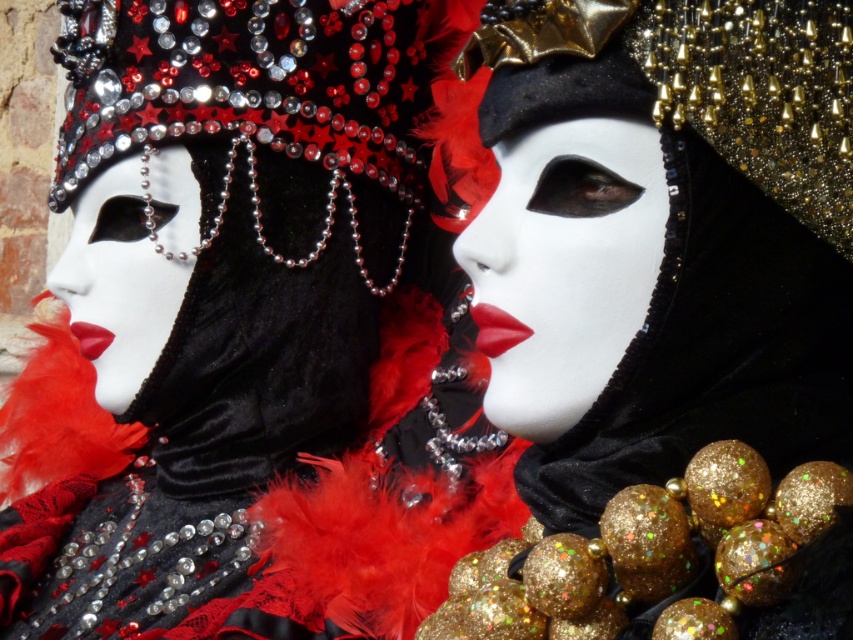
Does velvet mask at center have a lesser width compared to matte black mask at center?

No.

Who is more distant from viewer, (274, 464) or (572, 115)?

The point (274, 464) is behind.

The width and height of the screenshot is (853, 640). I want to click on velvet mask at center, so click(x=248, y=332).